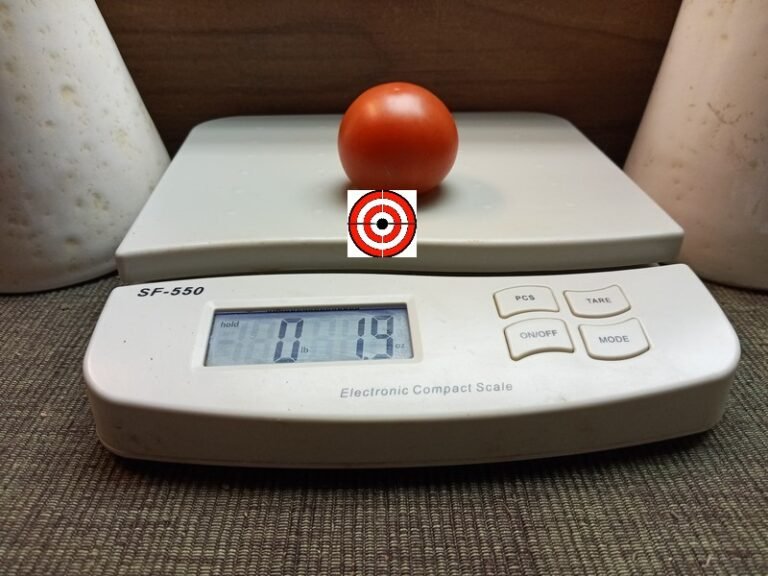
At what (x,y) coordinates should I click in order to perform the action: click on tan wood background. Please return your answer as a coordinate pair (x, y). This screenshot has width=768, height=576. Looking at the image, I should click on (219, 41).